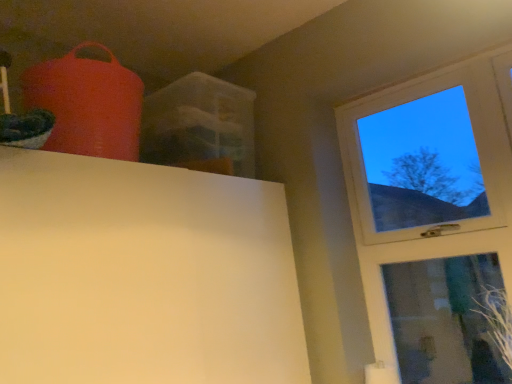
Where is `green leafy plant at lower right`? Image resolution: width=512 pixels, height=384 pixels. green leafy plant at lower right is located at coordinates (496, 319).

The height and width of the screenshot is (384, 512). What do you see at coordinates (496, 319) in the screenshot? I see `green leafy plant at lower right` at bounding box center [496, 319].

What do you see at coordinates (433, 218) in the screenshot? I see `transparent glass window at upper right` at bounding box center [433, 218].

Identify the location of transparent glass window at upper right. Image resolution: width=512 pixels, height=384 pixels. (433, 218).

Find the location of `green leafy plant at lower right`. green leafy plant at lower right is located at coordinates (496, 319).

Consider the image. Which is more to the left, green leafy plant at lower right or transparent glass window at upper right?

transparent glass window at upper right is more to the left.

Between green leafy plant at lower right and transparent glass window at upper right, which one is positioned behind?

transparent glass window at upper right is further from the camera.

Is point (503, 312) farther from camera compared to point (388, 93)?

No, (503, 312) is in front of (388, 93).

From the image's perspective, is green leafy plant at lower right located above or below transparent glass window at upper right?

Based on their image positions, green leafy plant at lower right is located beneath transparent glass window at upper right.

From a real-world perspective, which object stands above the other?

transparent glass window at upper right is physically above.

Does green leafy plant at lower right have a lesser width compared to transparent glass window at upper right?

No, green leafy plant at lower right is not thinner than transparent glass window at upper right.

Based on the photo, is green leafy plant at lower right taller or shorter than transparent glass window at upper right?

In the image, green leafy plant at lower right appears to be shorter than transparent glass window at upper right.

Looking at this image, considering the sizes of objects green leafy plant at lower right and transparent glass window at upper right in the image provided, who is smaller, green leafy plant at lower right or transparent glass window at upper right?

Smaller between the two is green leafy plant at lower right.

Looking at this image, is green leafy plant at lower right inside or outside of transparent glass window at upper right?

The correct answer is: outside.

Are green leafy plant at lower right and transparent glass window at upper right located far from each other?

green leafy plant at lower right is near transparent glass window at upper right, not far away.

From the picture: Is green leafy plant at lower right positioned with its back to transparent glass window at upper right?

Yes, transparent glass window at upper right is at the back of green leafy plant at lower right.

In order to click on window above the green leafy plant at lower right (from a real-world perspective) in this screenshot , I will do `click(433, 218)`.

In the scene shown: Does transparent glass window at upper right appear on the left side of green leafy plant at lower right?

Yes.

Which object is further away from the camera, transparent glass window at upper right or green leafy plant at lower right?

transparent glass window at upper right is further from the camera.

Does point (475, 221) come closer to viewer compared to point (511, 353)?

No.

From the image's perspective, which one is positioned higher, transparent glass window at upper right or green leafy plant at lower right?

transparent glass window at upper right appears higher in the image.

From a real-world perspective, who is located lower, transparent glass window at upper right or green leafy plant at lower right?

green leafy plant at lower right is physically lower.

Considering the relative sizes of transparent glass window at upper right and green leafy plant at lower right in the image provided, is transparent glass window at upper right thinner than green leafy plant at lower right?

Yes.

Can you confirm if transparent glass window at upper right is taller than green leafy plant at lower right?

Indeed, transparent glass window at upper right has a greater height compared to green leafy plant at lower right.

Looking at this image, can you confirm if transparent glass window at upper right is bigger than green leafy plant at lower right?

Indeed, transparent glass window at upper right has a larger size compared to green leafy plant at lower right.

Can we say transparent glass window at upper right lies outside green leafy plant at lower right?

Yes, transparent glass window at upper right is located beyond the bounds of green leafy plant at lower right.

Are transparent glass window at upper right and green leafy plant at lower right far apart?

transparent glass window at upper right is near green leafy plant at lower right, not far away.

Could you tell me if transparent glass window at upper right is turned towards green leafy plant at lower right?

Yes, transparent glass window at upper right is aimed at green leafy plant at lower right.

How different are the orientations of transparent glass window at upper right and green leafy plant at lower right in degrees?

They differ by 1.22 degrees in their facing directions.

Identify the location of plant lying below the transparent glass window at upper right (from the image's perspective). (496, 319).

Image resolution: width=512 pixels, height=384 pixels. I want to click on plant beneath the transparent glass window at upper right (from a real-world perspective), so click(496, 319).

Find the location of a particular element. Image resolution: width=512 pixels, height=384 pixels. window above the green leafy plant at lower right (from the image's perspective) is located at coordinates (433, 218).